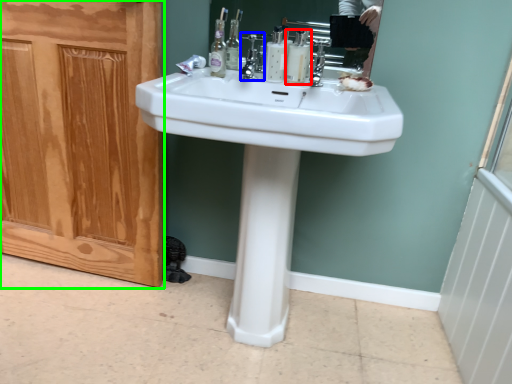
Question: Based on their relative distances, which object is farther from mouthwash (highlighted by a red box)? Choose from faucet (highlighted by a blue box) and screen door (highlighted by a green box).

Choices:
 (A) faucet
 (B) screen door

Answer: (B)